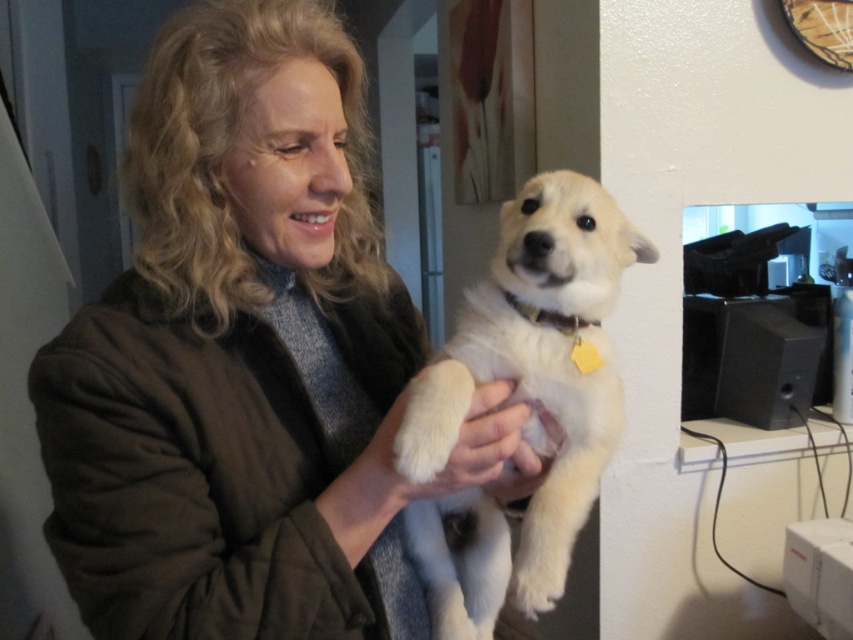
Question: Which point is farther to the camera?

Choices:
 (A) (515, 326)
 (B) (317, 131)

Answer: (A)

Question: Does matte brown jacket at center have a smaller size compared to white fluffy dog at center?

Choices:
 (A) no
 (B) yes

Answer: (A)

Question: Does matte brown jacket at center appear under white fluffy dog at center?

Choices:
 (A) no
 (B) yes

Answer: (A)

Question: From the image, what is the correct spatial relationship of matte brown jacket at center in relation to white fluffy dog at center?

Choices:
 (A) above
 (B) below

Answer: (A)

Question: Which object appears closest to the camera in this image?

Choices:
 (A) white fluffy dog at center
 (B) matte brown jacket at center

Answer: (B)